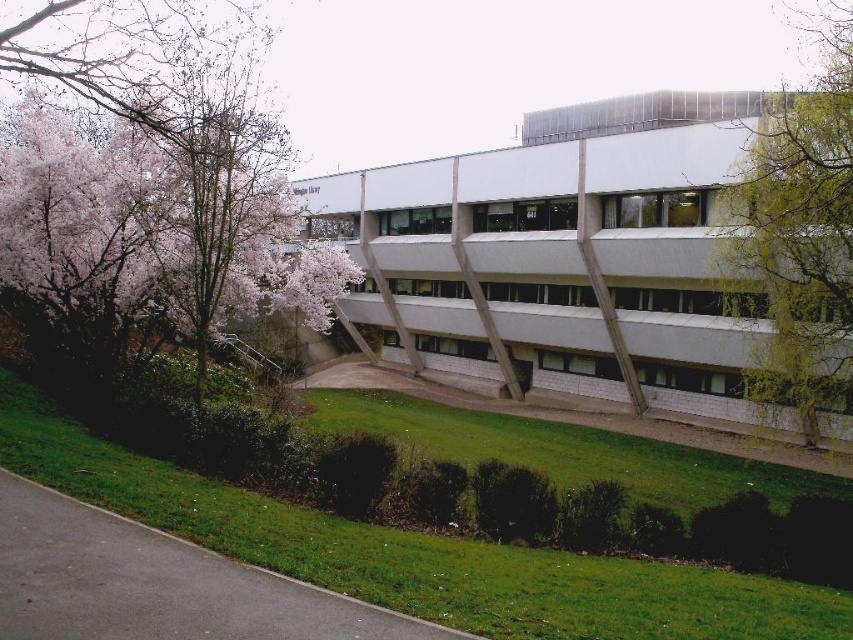
Is point (189, 109) in front of point (733, 285)?

Yes, point (189, 109) is closer to viewer.

Can you confirm if pink blossoming tree at left is positioned to the left of green leafy tree at right?

Correct, you'll find pink blossoming tree at left to the left of green leafy tree at right.

Where is `pink blossoming tree at left`? Image resolution: width=853 pixels, height=640 pixels. pink blossoming tree at left is located at coordinates (154, 177).